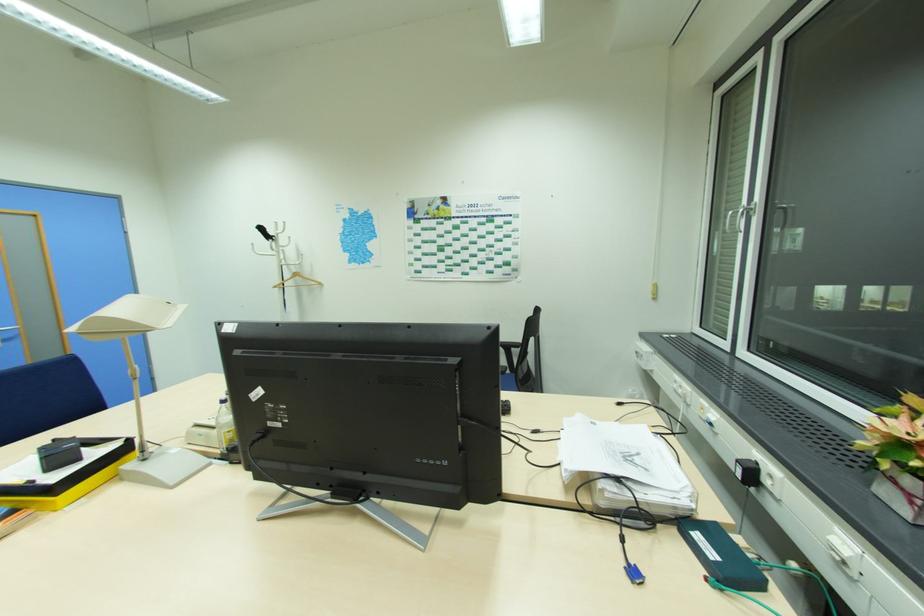
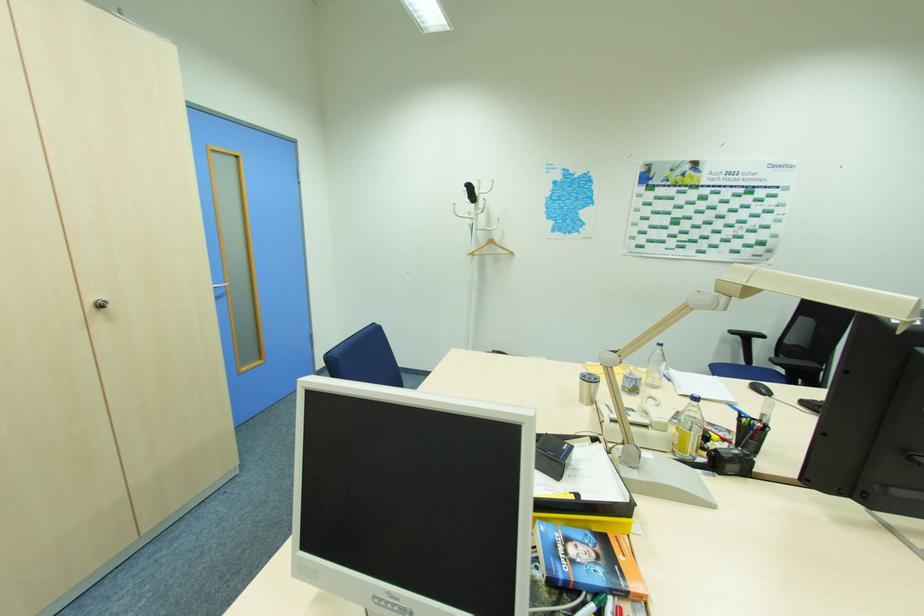
Locate, in the second image, the point that corresponds to pixel 296 264 in the first image.

(492, 229)